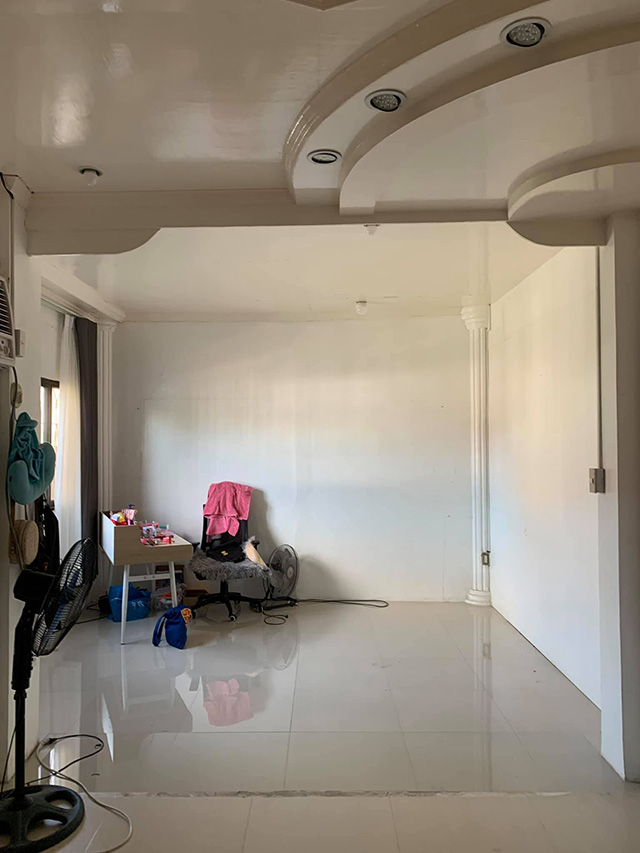
The width and height of the screenshot is (640, 853). I want to click on marble floor, so click(x=361, y=688).